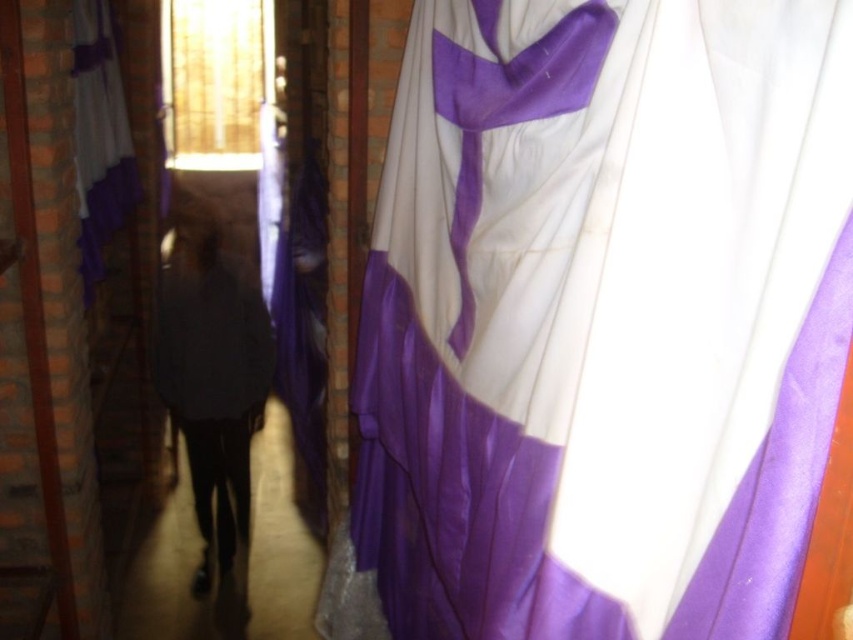
You are a painter standing in the corridor and want to hang a new painting on the wall behind the purple satin curtain at left. Can you hang it there without moving the matte black robe at center?

The matte black robe at center is located below the purple satin curtain at left, so you can hang the painting behind the purple satin curtain at left without moving the robe since it is positioned lower down.

You are standing at the entrance of the corridor and notice the purple satin curtain at center. Based on its position, can you determine if it is closer to the entrance or the end of the corridor?

The purple satin curtain at center is located at point (604, 316), which places it closer to the end of the corridor than the entrance.

You are standing in the corridor and want to locate the purple satin curtain at center. According to the coordinates provided, where should you look?

The purple satin curtain at center is located at point 0.495 on the x axis and 0.709 on the y axis.